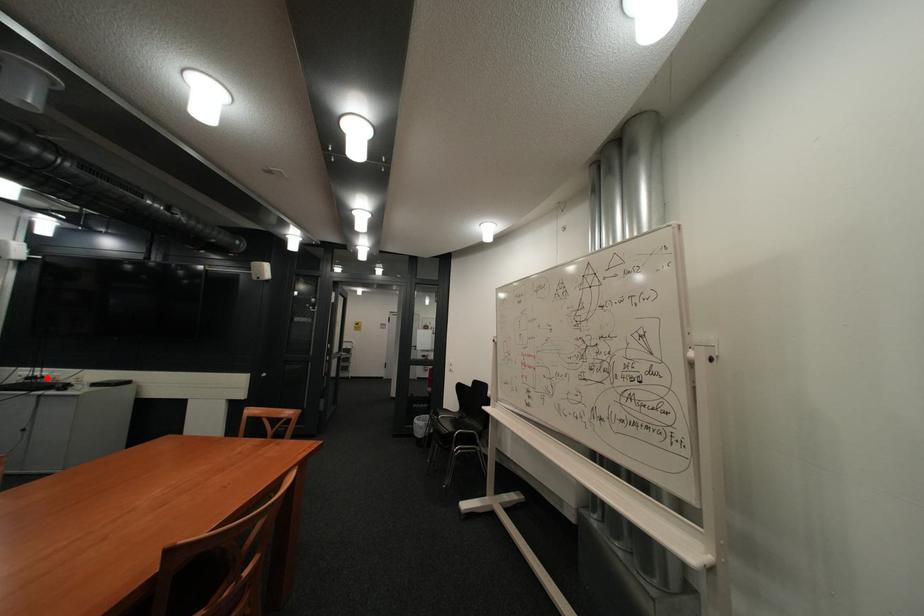
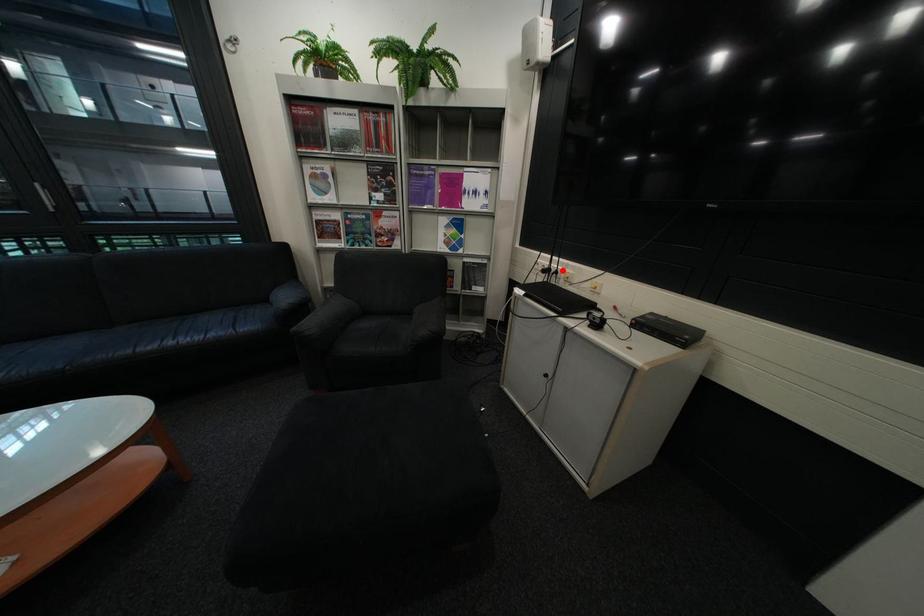
I am providing you with two images of the same scene from different viewpoints. A red point is marked on the first image and another point is marked on the second image. Does the point marked in image1 correspond to the same location as the one in image2?

Yes